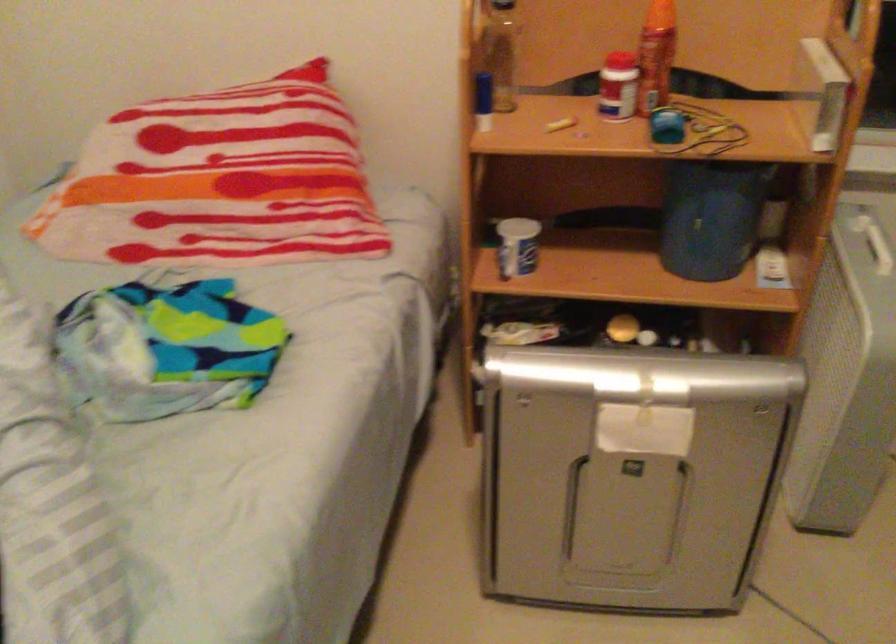
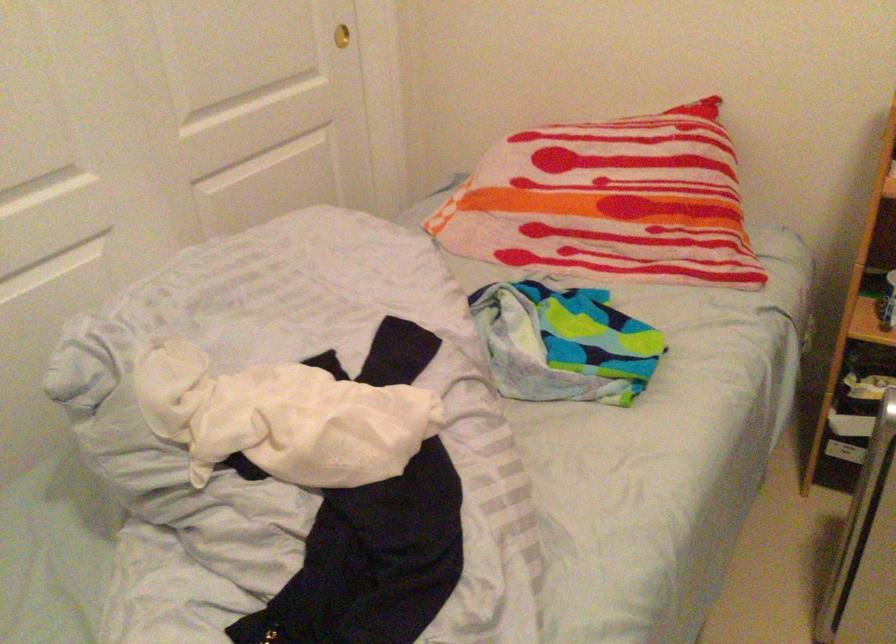
In the second image, find the point that corresponds to point (229, 182) in the first image.

(608, 202)